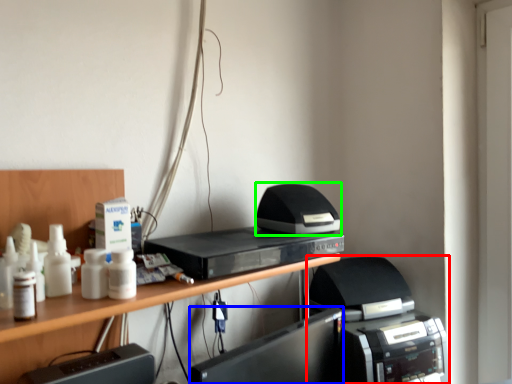
Question: Considering the real-world distances, which object is closest to printer (highlighted by a red box)? register (highlighted by a blue box) or printer (highlighted by a green box).

Choices:
 (A) register
 (B) printer

Answer: (A)